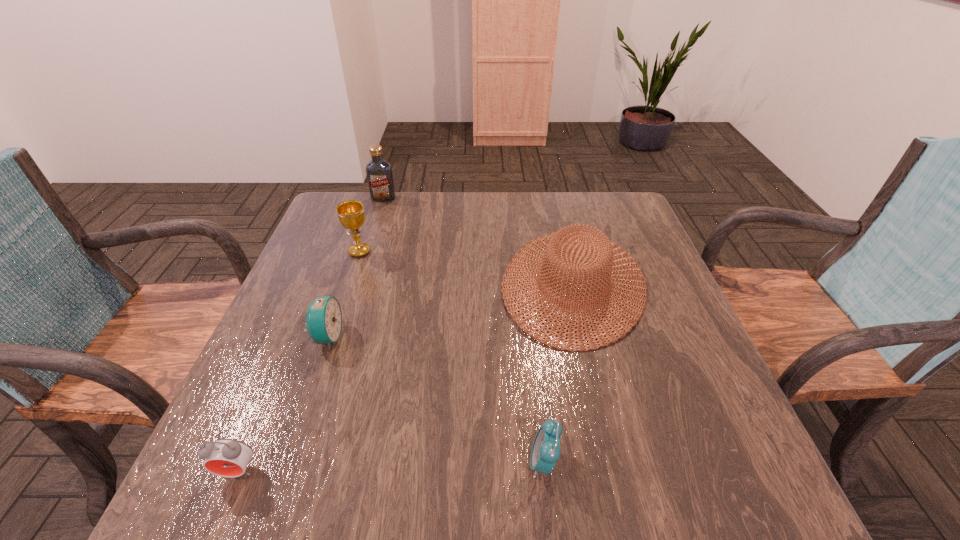
Locate an element on the screen. The image size is (960, 540). vacant space located 0.310m on the front-facing side of the farthest alarm clock is located at coordinates (487, 336).

At what (x,y) coordinates should I click in order to perform the action: click on blank area located on the face of the rightmost alarm clock. Please return your answer as a coordinate pair (x, y). Image resolution: width=960 pixels, height=540 pixels. Looking at the image, I should click on (450, 462).

This screenshot has width=960, height=540. In order to click on vacant space situated on the face of the rightmost alarm clock in this screenshot , I will do `click(330, 462)`.

I want to click on vacant space located 0.210m on the face of the rightmost alarm clock, so click(x=402, y=462).

Find the location of a particular element. vodka that is at the far edge is located at coordinates [379, 173].

Find the location of a particular element. sunhat that is at the far edge is located at coordinates (552, 249).

At what (x,y) coordinates should I click in order to perform the action: click on vodka situated at the left edge. Please return your answer as a coordinate pair (x, y). This screenshot has width=960, height=540. Looking at the image, I should click on (379, 173).

Locate an element on the screen. chalice present at the left edge is located at coordinates (351, 214).

Identify the location of object located at the right edge. Image resolution: width=960 pixels, height=540 pixels. (552, 249).

Locate an element on the screen. Image resolution: width=960 pixels, height=540 pixels. object that is at the far left corner is located at coordinates (379, 173).